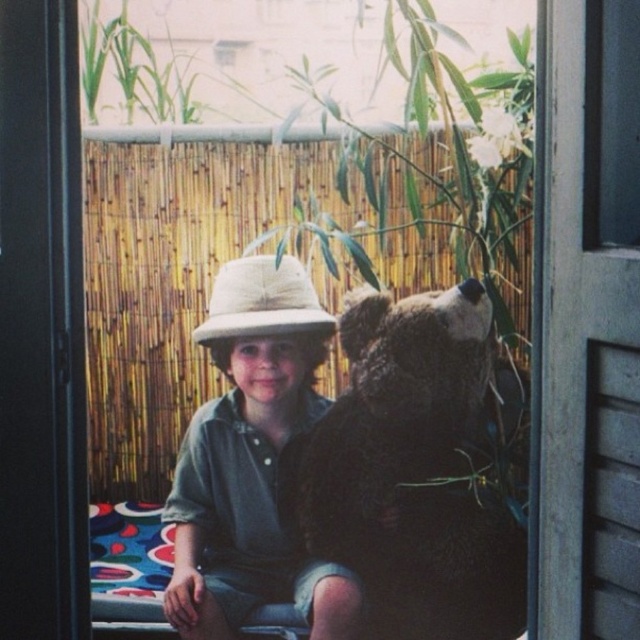
Question: Can you confirm if dark brown plush bear at center is positioned below matte khaki hat at center?

Choices:
 (A) no
 (B) yes

Answer: (B)

Question: Observing the image, what is the correct spatial positioning of dark brown plush bear at center in reference to matte khaki hat at center?

Choices:
 (A) below
 (B) above

Answer: (A)

Question: Among these points, which one is nearest to the camera?

Choices:
 (A) (252, 390)
 (B) (230, 298)
 (C) (378, 358)

Answer: (A)

Question: Which point appears farthest from the camera in this image?

Choices:
 (A) (381, 412)
 (B) (298, 269)
 (C) (284, 534)

Answer: (A)

Question: Which point appears closest to the camera in this image?

Choices:
 (A) (316, 445)
 (B) (253, 362)
 (C) (218, 294)

Answer: (B)

Question: Is matte khaki hat at center closer to the viewer compared to natural straw hat at center?

Choices:
 (A) yes
 (B) no

Answer: (A)